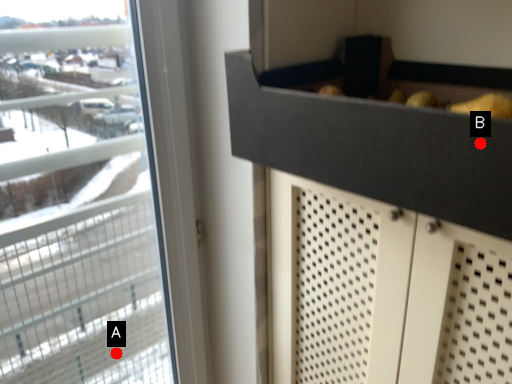
Question: Two points are circled on the image, labeled by A and B beside each circle. Which point is closer to the camera?

Choices:
 (A) A is closer
 (B) B is closer

Answer: (B)